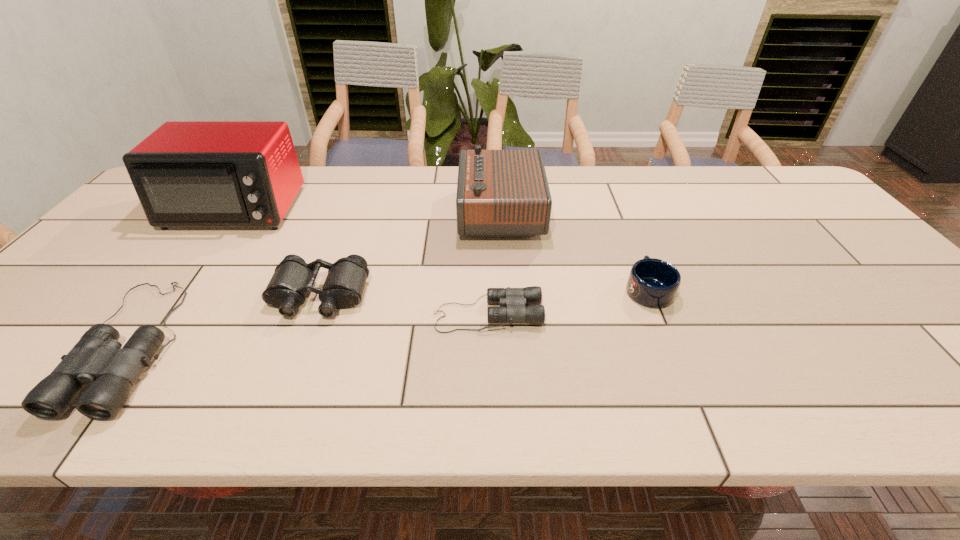
Find the location of `the leftmost binoculars`. the leftmost binoculars is located at coordinates (97, 358).

Identify the location of the shortest binoculars. (515, 299).

At what (x,y) coordinates should I click in order to perform the action: click on the rightmost binoculars. Please return your answer as a coordinate pair (x, y). This screenshot has width=960, height=540. Looking at the image, I should click on (515, 299).

Where is `radio receiver`? This screenshot has width=960, height=540. radio receiver is located at coordinates tap(500, 193).

This screenshot has height=540, width=960. Identify the location of the tallest object. (186, 173).

Where is `the third object from left to right`? the third object from left to right is located at coordinates (293, 278).

You are a GUI agent. You are given a task and a screenshot of the screen. Output one action in this format:
    pyautogui.click(x=<x>, y=<y>)
    Task: Click on the rightmost object
    
    Given the screenshot: What is the action you would take?
    pyautogui.click(x=654, y=283)

At what (x,y) coordinates should I click in order to perform the action: click on free region located 0.100m at the eyepiece of the rightmost binoculars. Please return your answer as a coordinate pair (x, y). Image resolution: width=960 pixels, height=540 pixels. Looking at the image, I should click on (585, 314).

Locate an element on the screen. Image resolution: width=960 pixels, height=540 pixels. vacant region located 0.390m on the front panel of the radio receiver is located at coordinates pyautogui.click(x=330, y=213).

Where is `free location located on the front panel of the radio receiver`? free location located on the front panel of the radio receiver is located at coordinates (396, 213).